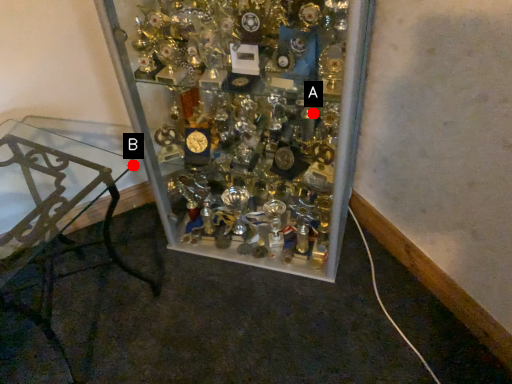
Question: Two points are circled on the image, labeled by A and B beside each circle. Which point is further to the camera?

Choices:
 (A) A is further
 (B) B is further

Answer: (B)